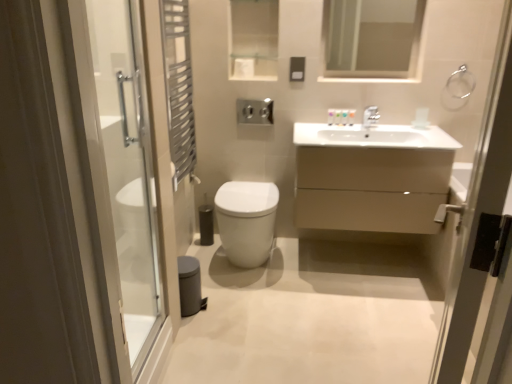
You are a GUI agent. You are given a task and a screenshot of the screen. Output one action in this format:
    pyautogui.click(x=<x>, y=<y>)
    Task: Click on the unoccupied region to the right of satin nickel faucet at upper center
    The height and width of the screenshot is (384, 512).
    Given the screenshot: What is the action you would take?
    pyautogui.click(x=395, y=127)